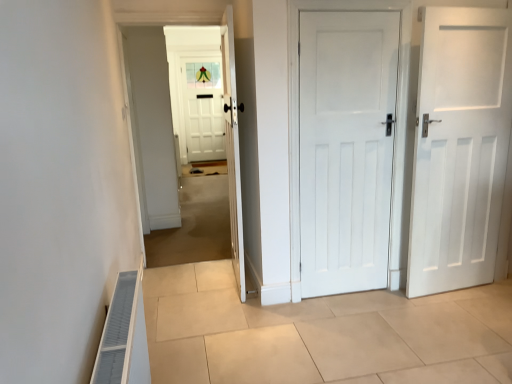
This screenshot has width=512, height=384. Identify the location of free space in front of white wooden door at center, placed as the first door when sorted from left to right. (232, 311).